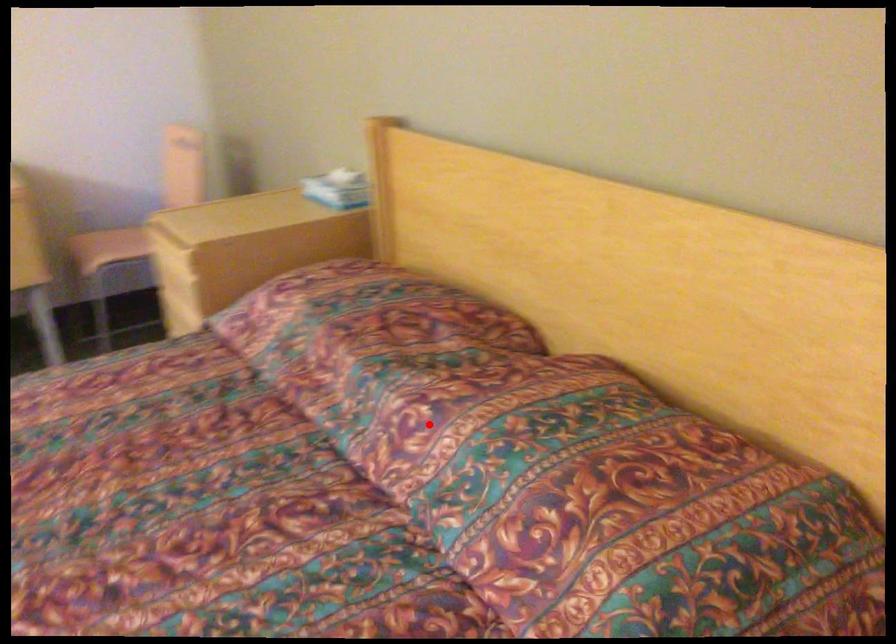
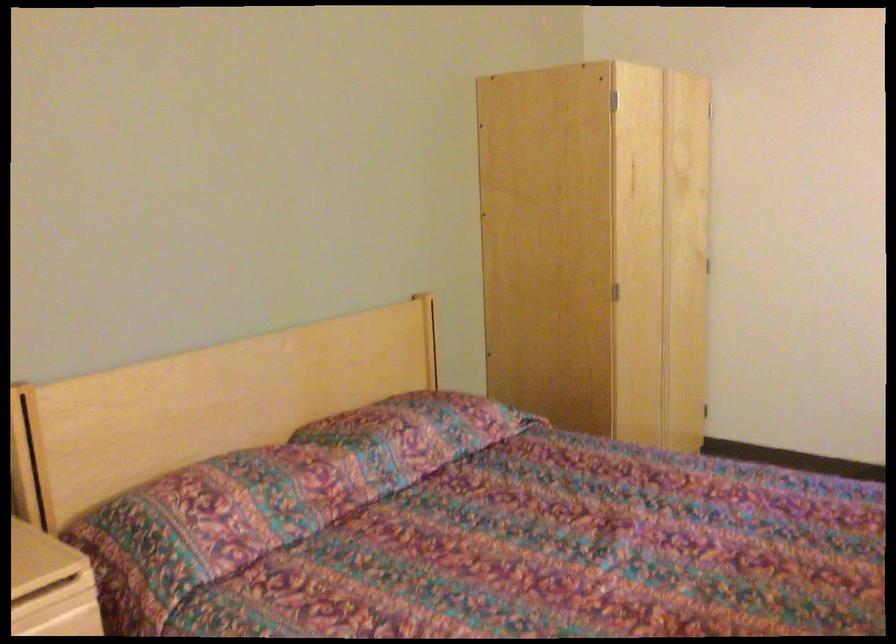
Question: I am providing you with two images of the same scene from different viewpoints. In image1, a red point is highlighted. Considering the same 3D point in image2, which of the following is correct?

Choices:
 (A) It is closer
 (B) It is farther

Answer: (B)